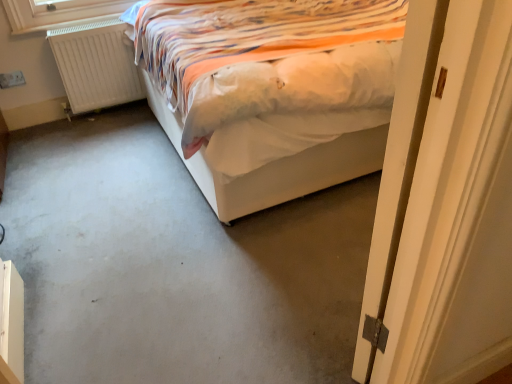
Locate an element on the screen. This screenshot has width=512, height=384. gray carpet at center is located at coordinates (174, 264).

The image size is (512, 384). Describe the element at coordinates (272, 91) in the screenshot. I see `white fabric bed at center` at that location.

What is the approximate width of white fabric bed at center?

white fabric bed at center is 2.05 meters wide.

The height and width of the screenshot is (384, 512). Describe the element at coordinates (445, 203) in the screenshot. I see `white wooden door at right` at that location.

The height and width of the screenshot is (384, 512). I want to click on gray carpet at center, so click(x=174, y=264).

Is white matte radiator at left to the left of white wooden door at right from the viewer's perspective?

Yes, white matte radiator at left is to the left of white wooden door at right.

Considering the relative positions of white matte radiator at left and white wooden door at right in the image provided, is white matte radiator at left in front of white wooden door at right?

No, white matte radiator at left is behind white wooden door at right.

Looking at this image, does white matte radiator at left have a larger size compared to white wooden door at right?

No, white matte radiator at left is not bigger than white wooden door at right.

From a real-world perspective, is white fabric bed at center physically above white wooden door at right?

No.

Is white fabric bed at center positioned in front of white wooden door at right?

No, white fabric bed at center is further to the viewer.

Would you consider white fabric bed at center to be distant from white wooden door at right?

Indeed, white fabric bed at center is not near white wooden door at right.

How different are the orientations of white fabric bed at center and white wooden door at right in degrees?

They differ by 64.6 degrees in their facing directions.

The image size is (512, 384). Identify the location of door that is on the right side of white fabric bed at center. (445, 203).

Is point (369, 320) positioned in front of point (132, 32)?

Yes, it is in front of point (132, 32).

Does white wooden door at right have a greater width compared to white fabric bed at center?

Incorrect, the width of white wooden door at right does not surpass that of white fabric bed at center.

Considering the sizes of objects white wooden door at right and white matte radiator at left in the image provided, who is shorter, white wooden door at right or white matte radiator at left?

white matte radiator at left.

Based on the photo, which of these two, white wooden door at right or white matte radiator at left, is wider?

Wider between the two is white wooden door at right.

The image size is (512, 384). Identify the location of radiator below the white wooden door at right (from a real-world perspective). (96, 65).

Is white wooden door at right outside of white matte radiator at left?

Yes.

Identify the location of concrete below the white matte radiator at left (from the image's perspective). This screenshot has height=384, width=512. (174, 264).

What's the angular difference between white matte radiator at left and gray carpet at center's facing directions?

The angle between the facing direction of white matte radiator at left and the facing direction of gray carpet at center is 0.337 degrees.

Choose the correct answer: Is white matte radiator at left inside gray carpet at center or outside it?

white matte radiator at left is outside gray carpet at center.

Could you tell me if white matte radiator at left is facing gray carpet at center?

Yes, white matte radiator at left is turned towards gray carpet at center.

Is white matte radiator at left directly adjacent to white fabric bed at center?

There is a gap between white matte radiator at left and white fabric bed at center.

At what (x,y) coordinates should I click in order to perform the action: click on radiator beneath the white fabric bed at center (from a real-world perspective). Please return your answer as a coordinate pair (x, y). The height and width of the screenshot is (384, 512). Looking at the image, I should click on (96, 65).

From the picture: Between white matte radiator at left and white fabric bed at center, which one appears on the right side from the viewer's perspective?

Positioned to the right is white fabric bed at center.

Which is in front, point (81, 49) or point (225, 182)?

The point (225, 182) is closer.

From a real-world perspective, is gray carpet at center positioned under white wooden door at right based on gravity?

Yes, from a real-world perspective, gray carpet at center is beneath white wooden door at right.

Which object is positioned more to the left, gray carpet at center or white wooden door at right?

gray carpet at center is more to the left.

Is gray carpet at center in front of white wooden door at right?

No, gray carpet at center is behind white wooden door at right.

The height and width of the screenshot is (384, 512). What are the coordinates of `radiator on the left of the white wooden door at right` in the screenshot? It's located at (96, 65).

Locate an element on the screen. door that is on the right side of white fabric bed at center is located at coordinates (445, 203).

Looking at the image, which one is located further to white matte radiator at left, white wooden door at right or gray carpet at center?

white wooden door at right lies further to white matte radiator at left than the other object.

Considering their positions, is white fabric bed at center positioned further to white matte radiator at left than gray carpet at center?

gray carpet at center.

Based on their spatial positions, is gray carpet at center or white matte radiator at left closer to white wooden door at right?

Based on the image, gray carpet at center appears to be nearer to white wooden door at right.

Considering their positions, is white fabric bed at center positioned closer to white wooden door at right than white matte radiator at left?

white fabric bed at center is positioned closer to the anchor white wooden door at right.

When comparing their distances from white matte radiator at left, does gray carpet at center or white wooden door at right seem closer?

Among the two, gray carpet at center is located nearer to white matte radiator at left.

When comparing their distances from white matte radiator at left, does gray carpet at center or white fabric bed at center seem further?

Based on the image, gray carpet at center appears to be further to white matte radiator at left.

Based on their spatial positions, is gray carpet at center or white matte radiator at left closer to white fabric bed at center?

gray carpet at center is positioned closer to the anchor white fabric bed at center.

When comparing their distances from white fabric bed at center, does white matte radiator at left or gray carpet at center seem closer?

Based on the image, gray carpet at center appears to be nearer to white fabric bed at center.

Identify the location of door between white fabric bed at center and gray carpet at center in the up-down direction. This screenshot has height=384, width=512. pyautogui.click(x=445, y=203).

Where is `concrete between white wooden door at right and white matte radiator at left from front to back`? This screenshot has height=384, width=512. concrete between white wooden door at right and white matte radiator at left from front to back is located at coordinates (174, 264).

I want to click on bed located between white wooden door at right and white matte radiator at left in the depth direction, so click(x=272, y=91).

The image size is (512, 384). What are the coordinates of `bed between gray carpet at center and white matte radiator at left from front to back` in the screenshot? It's located at (272, 91).